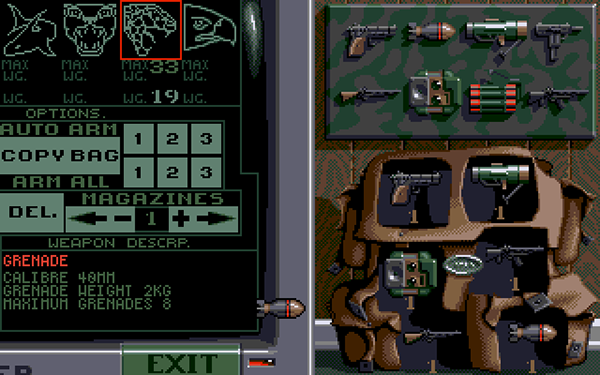
In order to click on black text "exit" in this screenshot , I will do `click(191, 361)`.